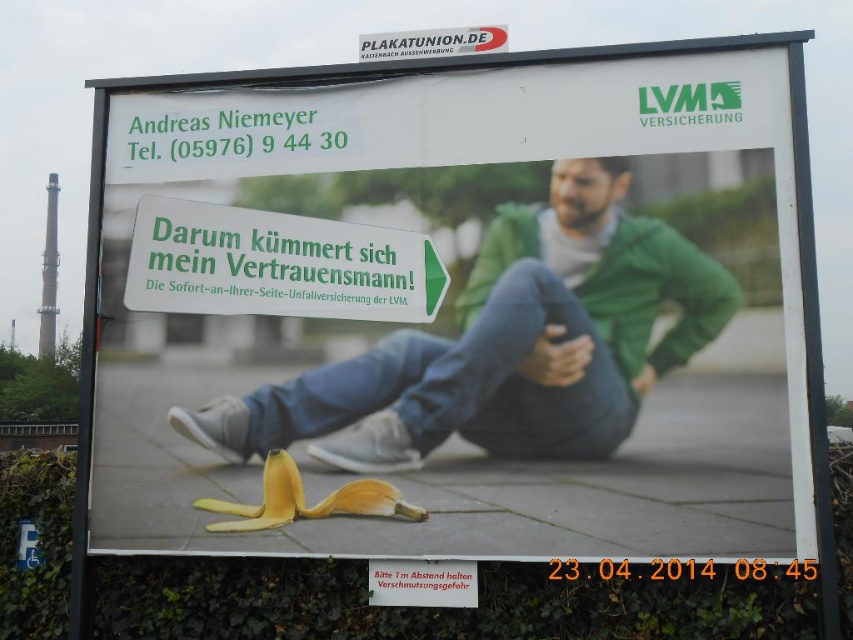
Does green plastic sign at center have a lesser height compared to yellow matte banana peel at center?

In fact, green plastic sign at center may be taller than yellow matte banana peel at center.

Is green plastic sign at center wider than yellow matte banana peel at center?

Correct, the width of green plastic sign at center exceeds that of yellow matte banana peel at center.

Consider the image. Who is more distant from viewer, (x=136, y=257) or (x=283, y=467)?

Positioned behind is point (x=136, y=257).

This screenshot has height=640, width=853. In order to click on green plastic sign at center in this screenshot , I will do [x=277, y=264].

Can you confirm if green plastic sign at center is wider than white plastic sign at upper center?

Yes, green plastic sign at center is wider than white plastic sign at upper center.

Does green plastic sign at center appear on the right side of white plastic sign at upper center?

No, green plastic sign at center is not to the right of white plastic sign at upper center.

Which is in front, point (422, 304) or point (405, 56)?

Positioned in front is point (422, 304).

This screenshot has height=640, width=853. In order to click on green plastic sign at center in this screenshot , I will do `click(277, 264)`.

At what (x,y) coordinates should I click in order to perform the action: click on yellow peel at lower center. Please return your answer as a coordinate pair (x, y). The width and height of the screenshot is (853, 640). Looking at the image, I should click on (463, 307).

This screenshot has height=640, width=853. What do you see at coordinates (463, 307) in the screenshot? I see `yellow peel at lower center` at bounding box center [463, 307].

You are a GUI agent. You are given a task and a screenshot of the screen. Output one action in this format:
    pyautogui.click(x=<x>, y=<y>)
    Task: Click on the yellow peel at lower center
    
    Given the screenshot: What is the action you would take?
    pyautogui.click(x=463, y=307)